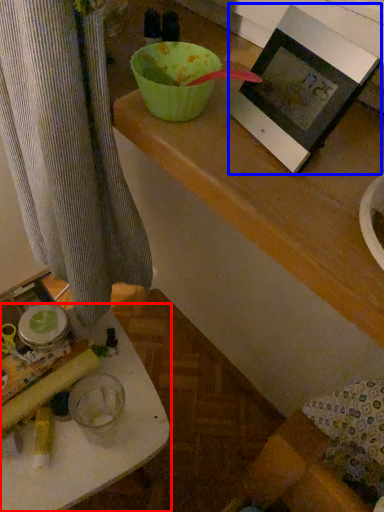
Question: Which object appears closest to the camera in this image, table (highlighted by a red box) or picture frame (highlighted by a blue box)?

Choices:
 (A) table
 (B) picture frame

Answer: (B)